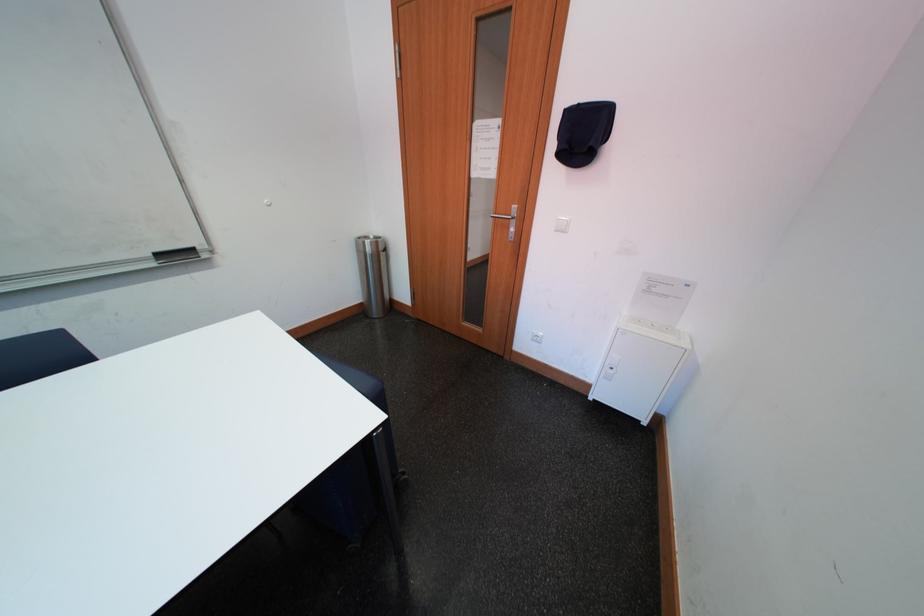
Where is `power outlet socket`? The width and height of the screenshot is (924, 616). power outlet socket is located at coordinates (536, 336).